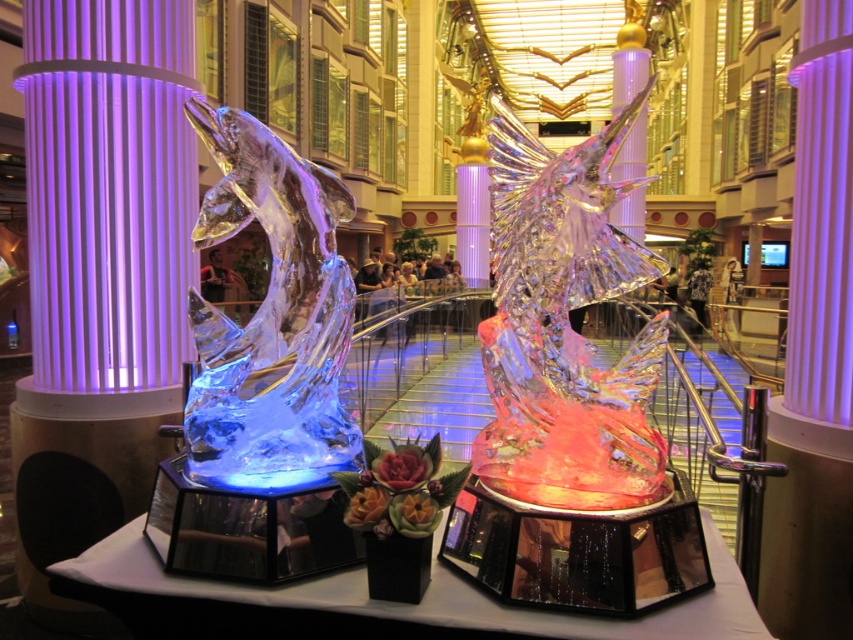
Can you confirm if purple translucent pillar at left is positioned to the left of transparent ice fish at left?

Correct, you'll find purple translucent pillar at left to the left of transparent ice fish at left.

Can you confirm if purple translucent pillar at left is positioned below transparent ice fish at left?

Actually, purple translucent pillar at left is above transparent ice fish at left.

Measure the distance between purple translucent pillar at left and camera.

They are 10.11 feet apart.

At what (x,y) coordinates should I click in order to perform the action: click on purple translucent pillar at left. Please return your answer as a coordinate pair (x, y). Looking at the image, I should click on (100, 269).

Between purple translucent pillar at left and transparent ice fish at center, which one has more height?

purple translucent pillar at left

Can you confirm if purple translucent pillar at left is taller than transparent ice fish at center?

Indeed, purple translucent pillar at left has a greater height compared to transparent ice fish at center.

The height and width of the screenshot is (640, 853). What do you see at coordinates (100, 269) in the screenshot? I see `purple translucent pillar at left` at bounding box center [100, 269].

Identify the location of purple translucent pillar at left. Image resolution: width=853 pixels, height=640 pixels. (100, 269).

Is transparent ice fish at center closer to the viewer compared to metallic column at center?

Yes.

Which is behind, point (508, 397) or point (816, 193)?

The point (816, 193) is more distant.

This screenshot has width=853, height=640. Identify the location of transparent ice fish at center. (566, 326).